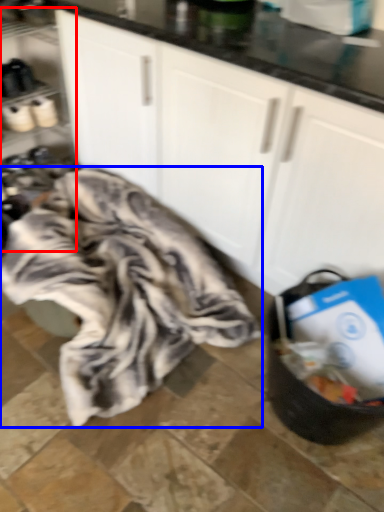
Question: Among these objects, which one is farthest to the camera, shelf (highlighted by a red box) or blanket (highlighted by a blue box)?

Choices:
 (A) shelf
 (B) blanket

Answer: (A)